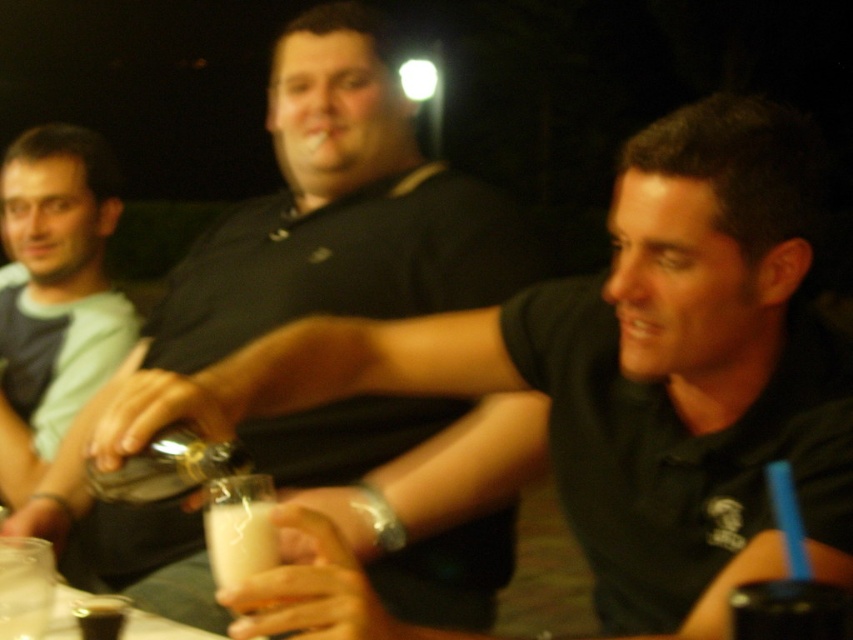
Question: Which point is closer to the camera taking this photo?

Choices:
 (A) (483, 582)
 (B) (846, 627)
 (C) (94, 365)
 (D) (96, 621)

Answer: (B)

Question: Which object is positioned farthest from the translucent glass cup at lower left?

Choices:
 (A) matte black shirt at center
 (B) white opaque cup at center

Answer: (A)

Question: Can you confirm if white opaque cup at center is smaller than translucent glass cup at lower left?

Choices:
 (A) no
 (B) yes

Answer: (B)

Question: Does light blue cotton shirt at left have a larger size compared to white opaque cup at center?

Choices:
 (A) yes
 (B) no

Answer: (A)

Question: Is white opaque cup at center bigger than translucent glass cup at lower left?

Choices:
 (A) no
 (B) yes

Answer: (A)

Question: Among these objects, which one is nearest to the camera?

Choices:
 (A) light blue cotton shirt at left
 (B) black plastic cup at lower right
 (C) translucent glass cup at lower left

Answer: (B)